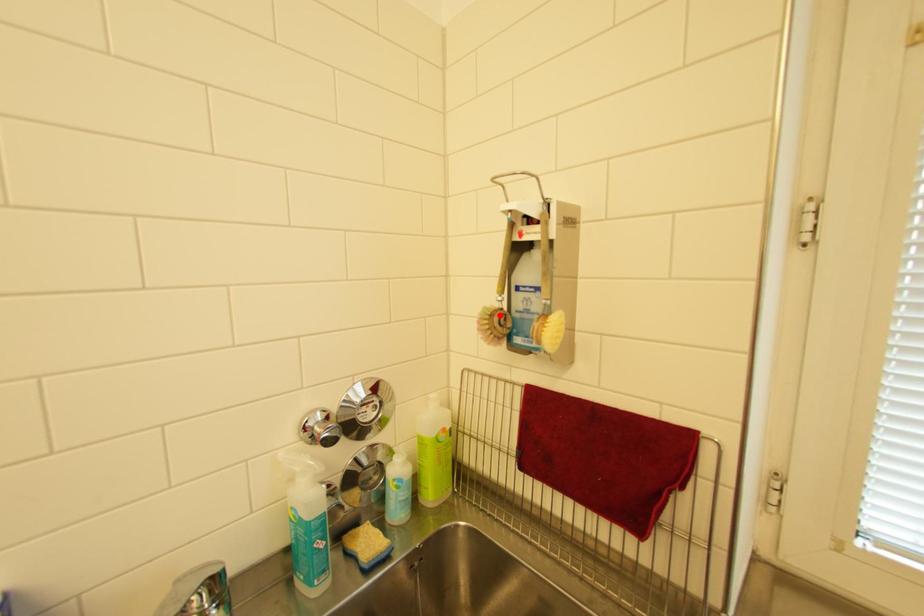
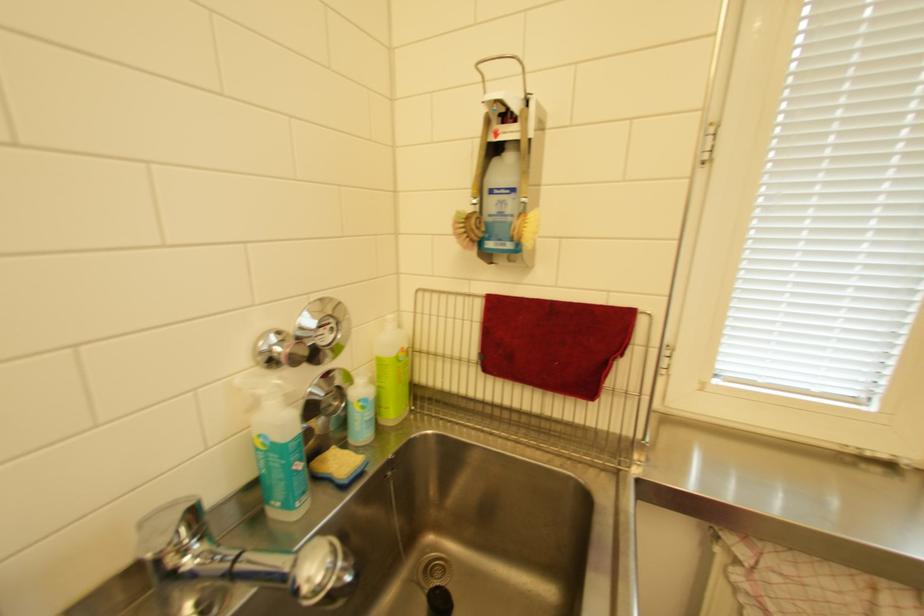
Locate, in the second image, the point that corresponds to the highlighted location in the first image.

(475, 217)